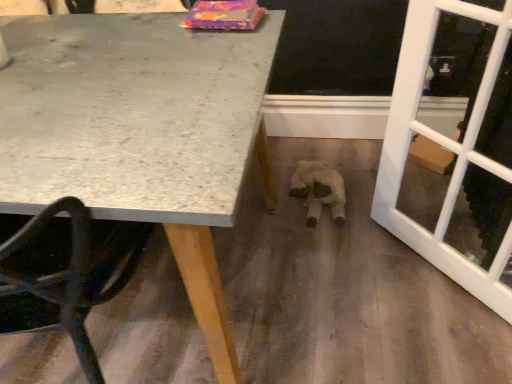
Locate an element on the screen. free point to the right of white plush toy at center is located at coordinates (374, 178).